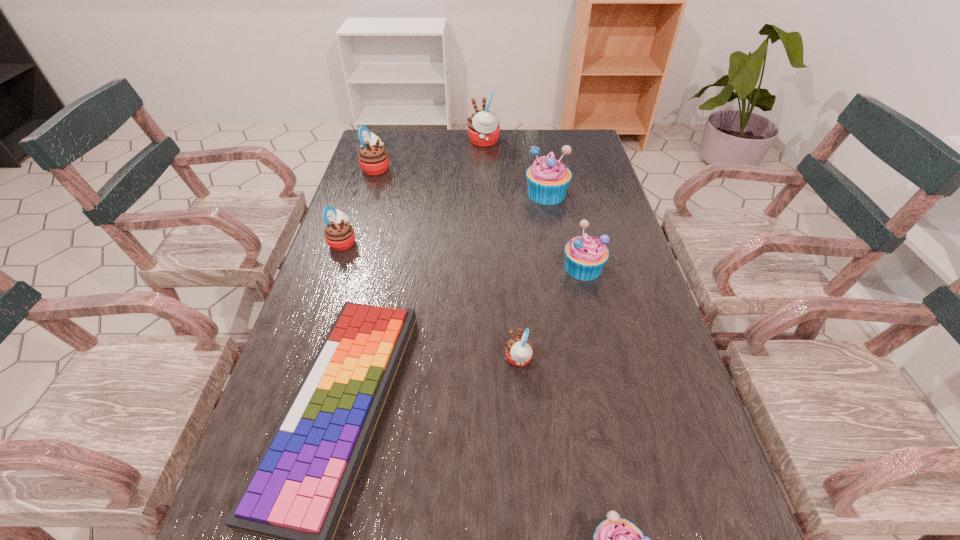
This screenshot has width=960, height=540. In order to click on vacant space situated 0.180m on the front-facing side of the smallest pink muffin in this screenshot , I will do `click(420, 359)`.

At what (x,y) coordinates should I click in order to perform the action: click on vacant space located 0.230m on the front-facing side of the smallest pink muffin. Please return your answer as a coordinate pair (x, y). Looking at the image, I should click on (396, 359).

Find the location of `object at the far left corner`. object at the far left corner is located at coordinates (373, 159).

In order to click on vacant space at the far edge of the desktop in this screenshot , I will do `click(487, 147)`.

In the image, there is a desktop. In order to click on vacant space at the left edge in this screenshot , I will do `click(376, 231)`.

Locate an element on the screen. The height and width of the screenshot is (540, 960). free space at the right edge of the desktop is located at coordinates (590, 300).

Locate an element on the screen. The width and height of the screenshot is (960, 540). free space between the second farthest muffin and the second farthest blue muffin is located at coordinates tap(479, 218).

Locate an element on the screen. This screenshot has width=960, height=540. vacant space that's between the nearest pink muffin and the third smallest pink muffin is located at coordinates (447, 264).

This screenshot has width=960, height=540. I want to click on free space between the smallest pink muffin and the third farthest object, so click(533, 276).

Where is `free area in between the farthest blue muffin and the second farthest object`? Image resolution: width=960 pixels, height=540 pixels. free area in between the farthest blue muffin and the second farthest object is located at coordinates (461, 181).